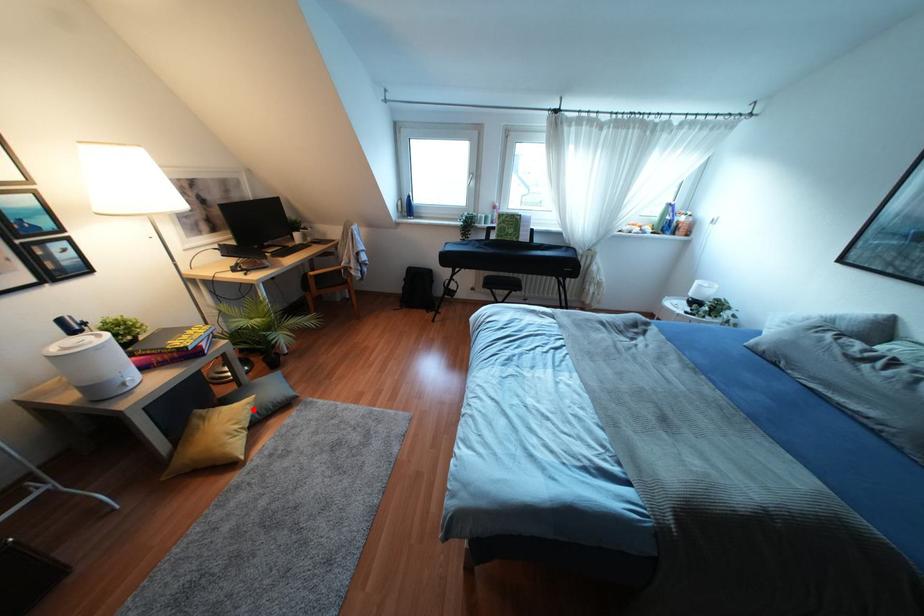
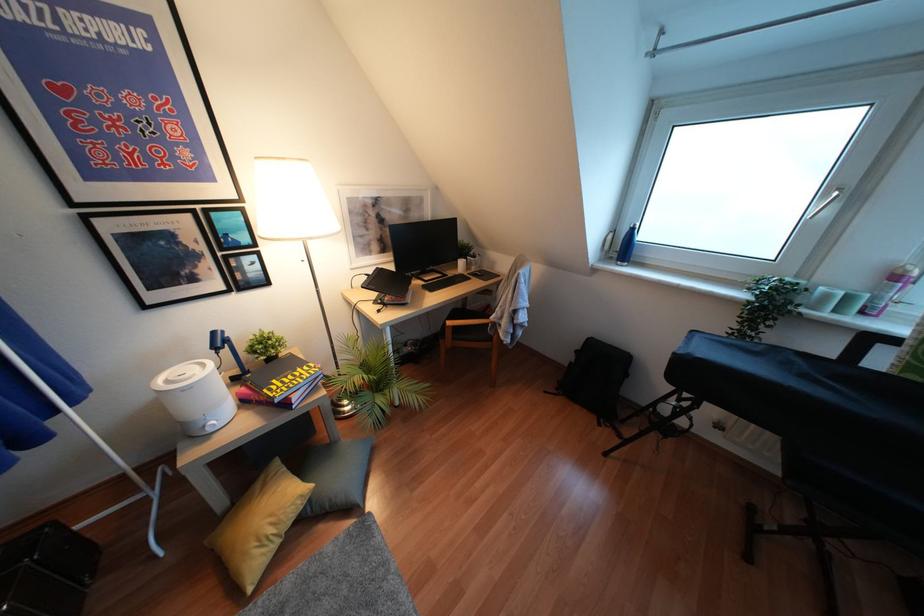
Question: A red point is marked in image1. In image2, is the corresponding 3D point closer to the camera or farther? Reply with the corresponding letter.

Choices:
 (A) The corresponding 3D point is closer.
 (B) The corresponding 3D point is farther.

Answer: (B)